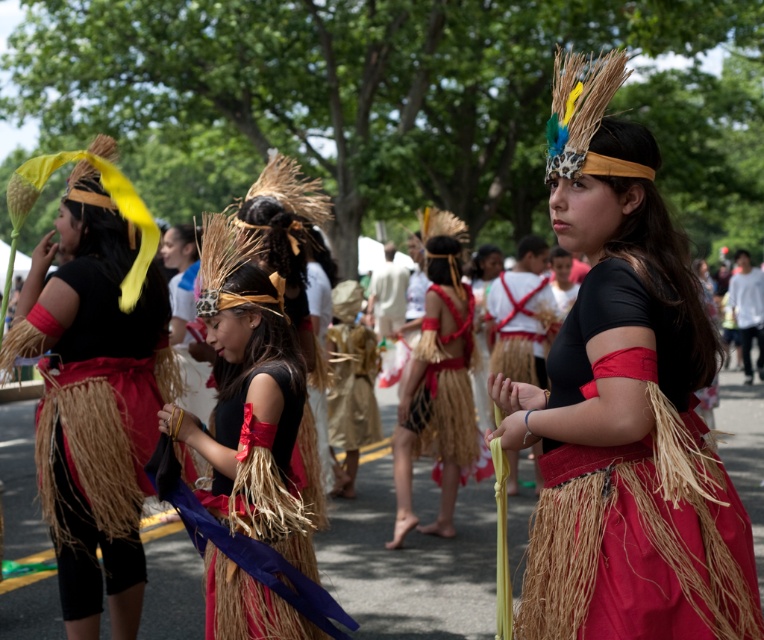
Question: Is raffia skirt at center closer to camera compared to red woven grass skirt at center?

Choices:
 (A) yes
 (B) no

Answer: (A)

Question: Which point is closer to the camera?

Choices:
 (A) (555, 616)
 (B) (267, 314)
 (C) (436, 312)
 (D) (439, 477)

Answer: (A)

Question: Does matte straw headdress at left appear under matte straw skirt at center?

Choices:
 (A) yes
 (B) no

Answer: (A)

Question: Which is nearer to the matte straw headdress at left?

Choices:
 (A) matte straw skirt at center
 (B) matte black top at center
 (C) raffia skirt at center
 (D) red woven grass skirt at center

Answer: (C)

Question: Is matte black top at center positioned in front of red woven grass skirt at center?

Choices:
 (A) yes
 (B) no

Answer: (A)

Question: Which point appears closest to the camera in this image?

Choices:
 (A) (13, 358)
 (B) (450, 269)

Answer: (A)